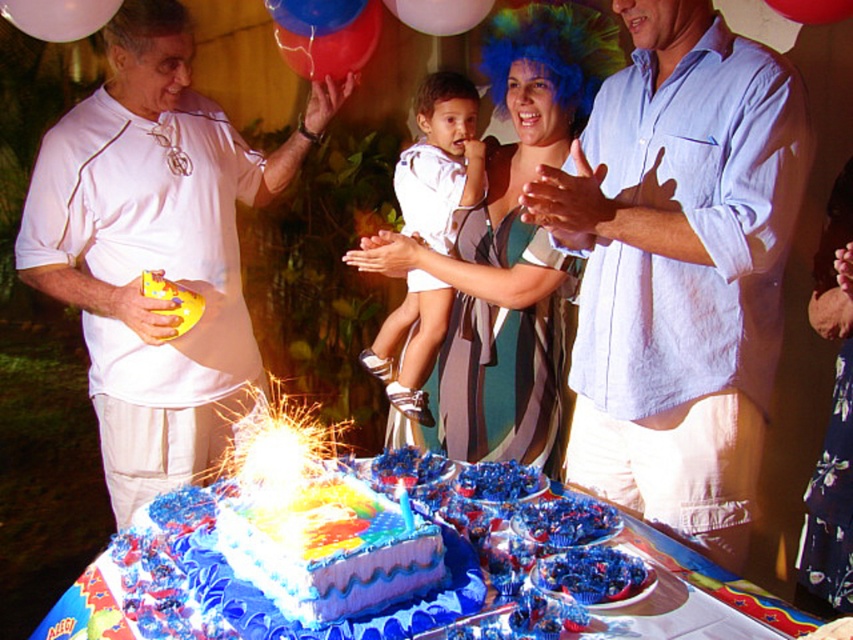
You are a photographer at the birthday party and need to capture a group photo of the white matte shirt at left and the striped dress at center. Considering their heights, which person should stand in the back to avoid blocking the other?

The white matte shirt at left is much taller than the striped dress at center, so the person wearing the white matte shirt at left should stand in the back to avoid blocking the shorter person in the striped dress at center.

You are at a birthday party and want to take a photo of the cake and cupcakes. The camera you are using has a focal length of 50mm. If the point at coordinates point [28,234] is 6.42 feet away from the camera, can you estimate how far the cake and cupcakes are from the camera?

The point at coordinates point [28,234] is 6.42 feet from the camera. Since this point is part of the cake and cupcakes arrangement, the cake and cupcakes are approximately 6.42 feet away from the camera.

You are standing at the edge of the table in the birthday scene. You see two points marked on the table surface. The first point is at coordinates point (730,164) and the second point is at point (312,4). If you want to place a gift box on the table such that it is closer to the first point than the second, where should you position it?

To place the gift box closer to point (730,164) than point (312,4), position it near the first point since it is in front of the second point.